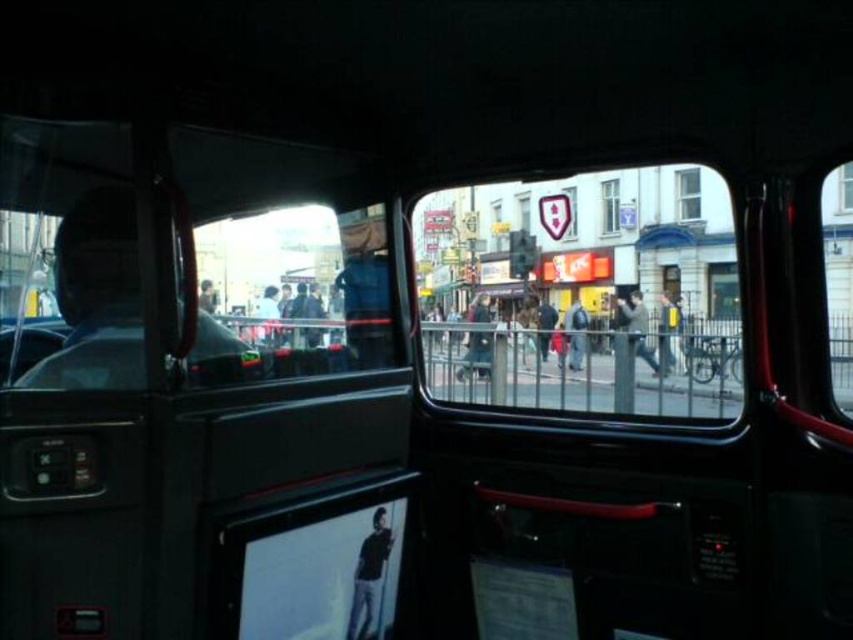
Question: Can you confirm if dark gray jacket at center is positioned to the left of light brown leather jacket at center?

Choices:
 (A) no
 (B) yes

Answer: (B)

Question: Is matte black crowd at center in front of matte plastic shield at center?

Choices:
 (A) no
 (B) yes

Answer: (B)

Question: Which point is closer to the camera?

Choices:
 (A) light brown leather jacket at center
 (B) transparent glass window at center
 (C) clear glass window at upper center
 (D) clear glass bus window at center

Answer: (B)

Question: Which object is positioned farthest from the dark gray sweater at center?

Choices:
 (A) clear glass bus window at center
 (B) matte black crowd at center
 (C) matte plastic shield at center
 (D) clear glass window at upper center

Answer: (C)

Question: Does clear glass window at upper center have a smaller size compared to matte plastic shield at center?

Choices:
 (A) no
 (B) yes

Answer: (A)

Question: Which object appears closest to the camera in this image?

Choices:
 (A) matte plastic shield at center
 (B) light gray jacket at center
 (C) dark brown leather jacket at center
 (D) transparent glass window at center

Answer: (D)